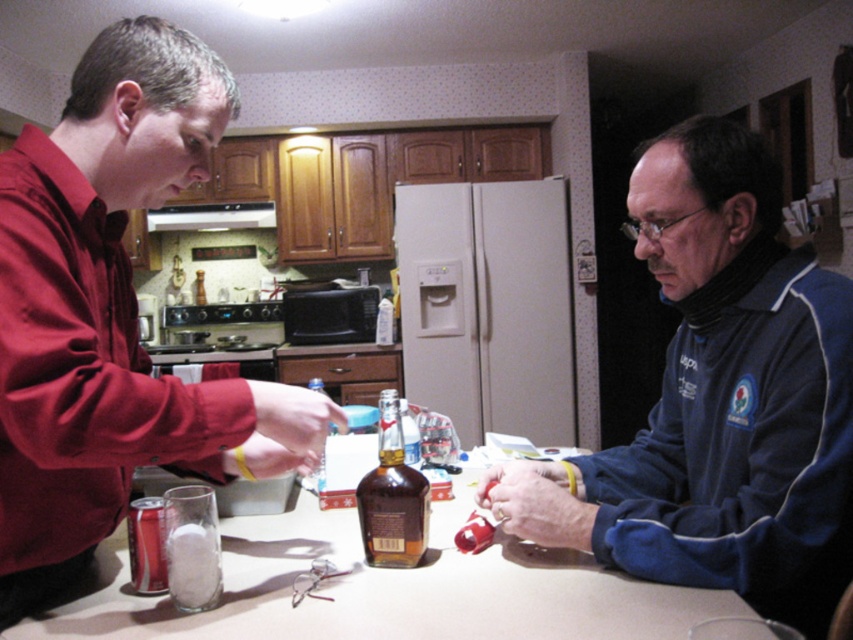
You are standing in the kitchen and want to reach both the point at location (740, 531) and the point at (544, 560). Which point should you move towards first to reach the closer one?

Point (740, 531) is closer to the viewer than point 0.875, 0.875, so you should move towards point (740, 531) first.

You are organizing the kitchen counter and need to place the blue fleece jacket at center. Where exactly should you position it based on the coordinates provided?

The blue fleece jacket at center should be positioned at the coordinates point [718,400] as specified.

You are organizing a small event and need to decide which of the two items, the blue fleece jacket at center or the matte red shirt at center, can be folded and stored in a drawer that can only accommodate items smaller than the other. Which item should you choose?

The matte red shirt at center should be chosen because it is smaller than the blue fleece jacket at center, making it suitable for the drawer.